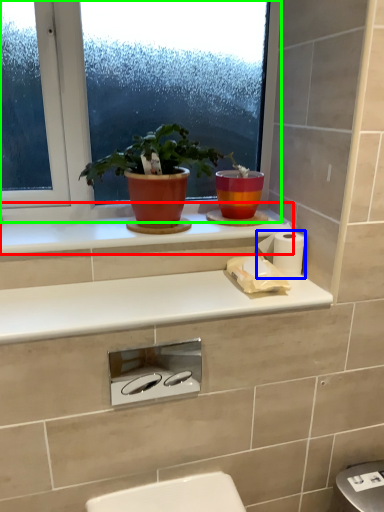
Question: Which object is the farthest from window sill (highlighted by a red box)? Choose among these: toilet paper (highlighted by a blue box) or window (highlighted by a green box).

Choices:
 (A) toilet paper
 (B) window

Answer: (A)